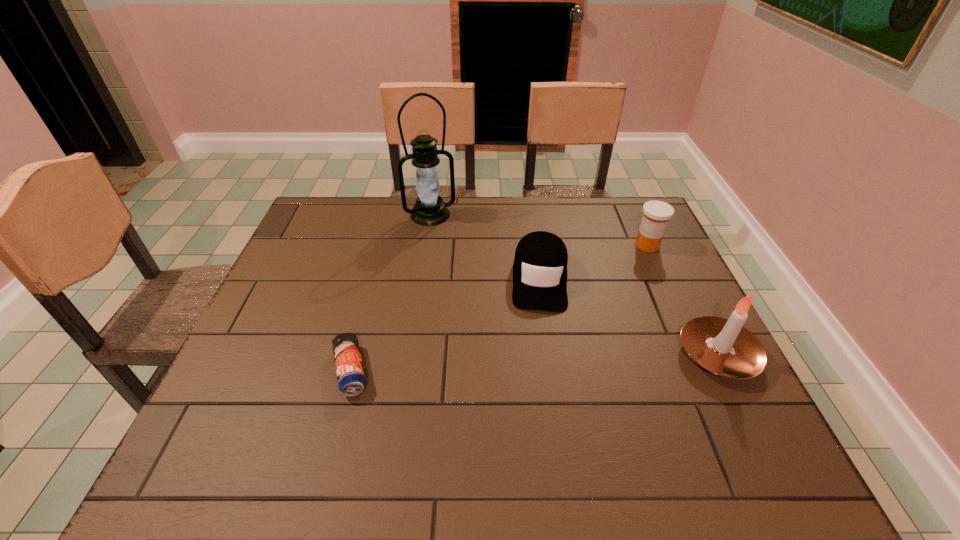
I want to click on free space on the desktop that is between the shortest object and the candle and is positioned on the front-facing side of the third object from right to left, so point(539,363).

The width and height of the screenshot is (960, 540). What are the coordinates of `free space on the desktop that is between the shortest object and the fourth shortest object and is positioned on the label of the medicine` in the screenshot? It's located at (541, 363).

Find the location of `vacant space on the desktop that is between the shortest object and the candle and is positioned on the side where the tallest object emits light`. vacant space on the desktop that is between the shortest object and the candle and is positioned on the side where the tallest object emits light is located at coordinates (498, 364).